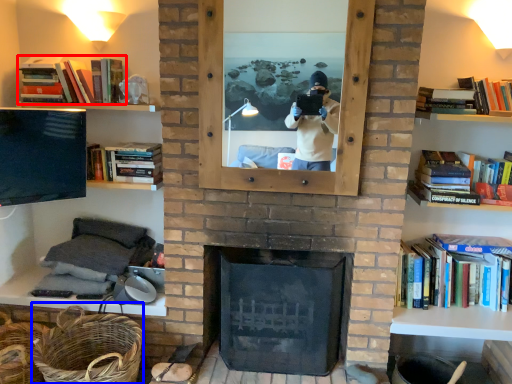
Question: Among these objects, which one is farthest to the camera, book (highlighted by a red box) or basket (highlighted by a blue box)?

Choices:
 (A) book
 (B) basket

Answer: (A)